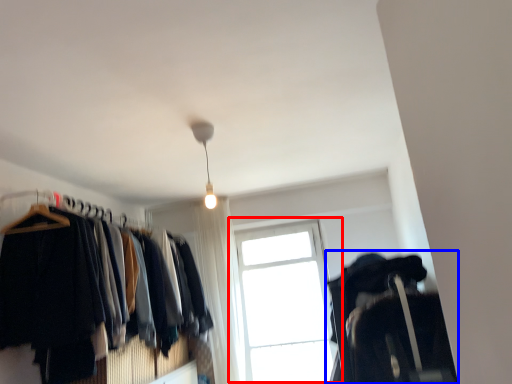
Question: Which object appears farthest to the camera in this image, window (highlighted by a red box) or closet (highlighted by a blue box)?

Choices:
 (A) window
 (B) closet

Answer: (A)